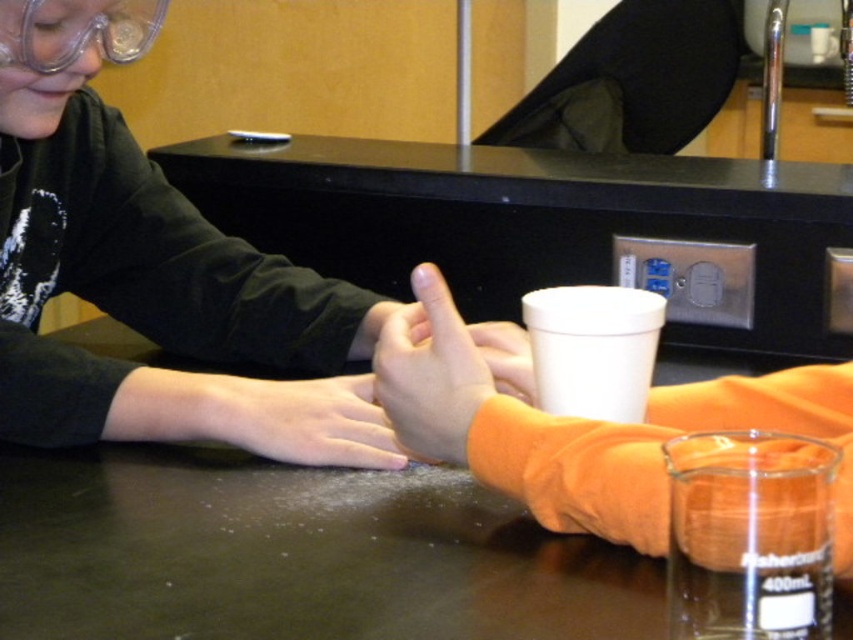
Does point (477, 609) come in front of point (247, 429)?

Yes, point (477, 609) is in front of point (247, 429).

Between smooth dark brown table at center and smooth skin hand at center, which one appears on the right side from the viewer's perspective?

smooth dark brown table at center

Between point (537, 596) and point (265, 436), which one is positioned in front?

Positioned in front is point (537, 596).

I want to click on smooth dark brown table at center, so click(x=294, y=554).

Who is positioned more to the left, smooth dark brown table at center or orange fabric hand at center?

Positioned to the left is smooth dark brown table at center.

In the scene shown: Is smooth dark brown table at center behind orange fabric hand at center?

No.

Between point (276, 580) and point (421, 436), which one is positioned in front?

Point (276, 580) is more forward.

At what (x,y) coordinates should I click in order to perform the action: click on smooth dark brown table at center. Please return your answer as a coordinate pair (x, y). The image size is (853, 640). Looking at the image, I should click on (294, 554).

From the picture: Is translucent amber liquid at lower right smaller than orange fabric hand at center?

Correct, translucent amber liquid at lower right occupies less space than orange fabric hand at center.

Can you confirm if translucent amber liquid at lower right is thinner than orange fabric hand at center?

Indeed, translucent amber liquid at lower right has a lesser width compared to orange fabric hand at center.

Describe the element at coordinates (749, 536) in the screenshot. I see `translucent amber liquid at lower right` at that location.

In order to click on translucent amber liquid at lower right in this screenshot , I will do `click(749, 536)`.